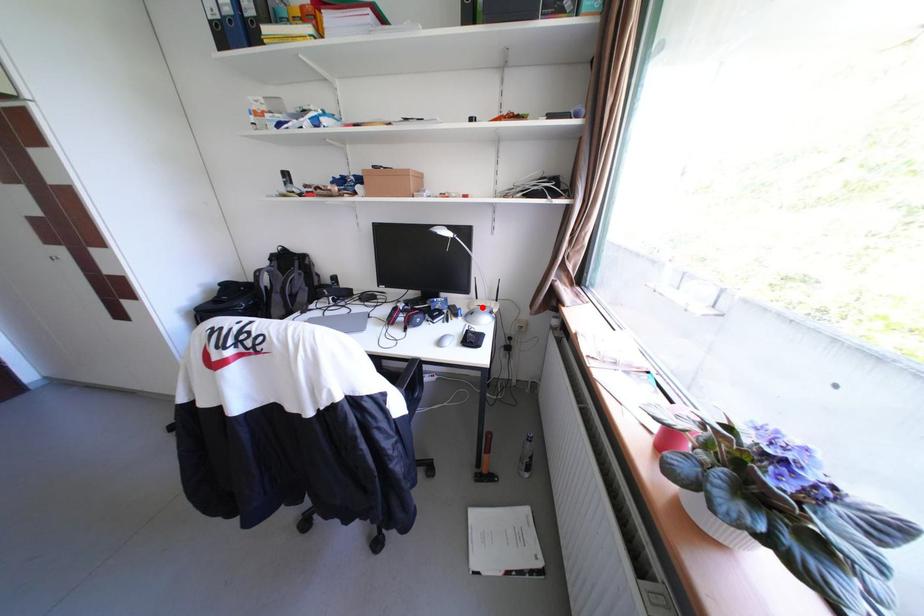
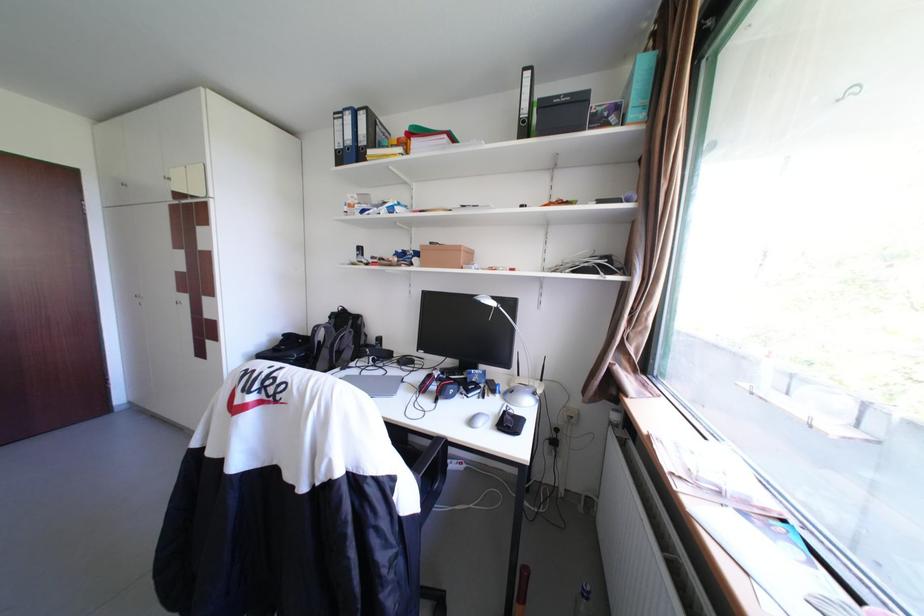
Question: I am providing you with two images of the same scene from different viewpoints. In image1, a red point is highlighted. Considering the same 3D point in image2, which of the following is correct?

Choices:
 (A) It is closer
 (B) It is farther

Answer: (B)